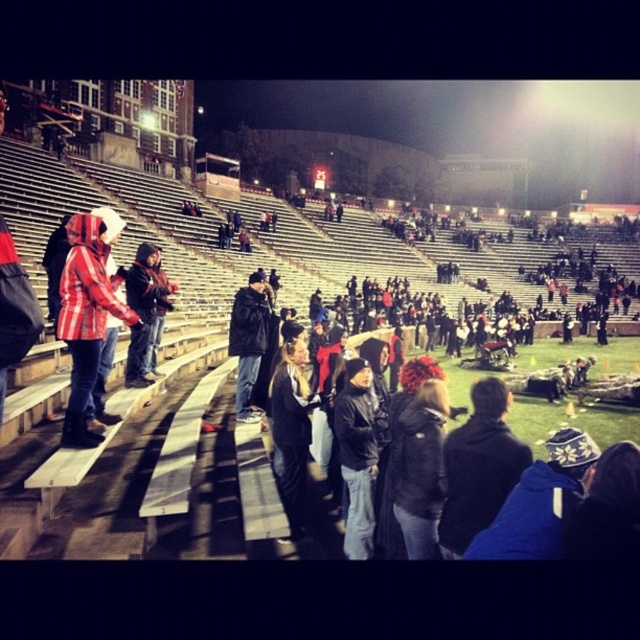
Question: Can you confirm if dark blue jacket at center is positioned to the right of dark red hoodie at center?

Choices:
 (A) no
 (B) yes

Answer: (B)

Question: Is dark gray leather jacket at center to the right of black fabric jacket at center from the viewer's perspective?

Choices:
 (A) yes
 (B) no

Answer: (A)

Question: Which object is the closest to the dark gray hoodie at center?

Choices:
 (A) red plaid jacket at left
 (B) black fabric jacket at center
 (C) dark gray leather jacket at center
 (D) dark blue jacket at center

Answer: (C)

Question: From the image, what is the correct spatial relationship of dark blue jacket at center in relation to dark red hoodie at center?

Choices:
 (A) right
 (B) left

Answer: (A)

Question: Which object is the farthest from the dark blue jacket at center?

Choices:
 (A) black leather jacket at center
 (B) dark gray leather jacket at center

Answer: (A)

Question: Among these objects, which one is farthest from the camera?

Choices:
 (A) dark red hoodie at center
 (B) black leather jacket at center

Answer: (B)